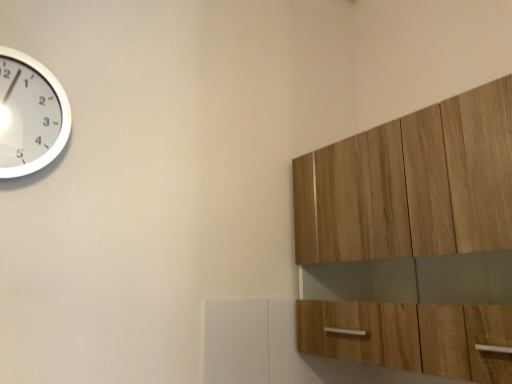
Question: Considering the relative positions of light wood cabinet at upper right and white metallic clock at upper left in the image provided, is light wood cabinet at upper right to the left or to the right of white metallic clock at upper left?

Choices:
 (A) left
 (B) right

Answer: (B)

Question: From the image's perspective, is light wood cabinet at upper right located above or below white metallic clock at upper left?

Choices:
 (A) above
 (B) below

Answer: (B)

Question: Is point (337, 221) closer or farther from the camera than point (32, 125)?

Choices:
 (A) farther
 (B) closer

Answer: (A)

Question: From a real-world perspective, relative to light wood cabinet at upper right, is white metallic clock at upper left vertically above or below?

Choices:
 (A) above
 (B) below

Answer: (A)

Question: Considering the positions of white metallic clock at upper left and light wood cabinet at upper right in the image, is white metallic clock at upper left wider or thinner than light wood cabinet at upper right?

Choices:
 (A) wide
 (B) thin

Answer: (B)

Question: From the image's perspective, relative to light wood cabinet at upper right, is white metallic clock at upper left above or below?

Choices:
 (A) below
 (B) above

Answer: (B)

Question: In terms of height, does white metallic clock at upper left look taller or shorter compared to light wood cabinet at upper right?

Choices:
 (A) tall
 (B) short

Answer: (B)